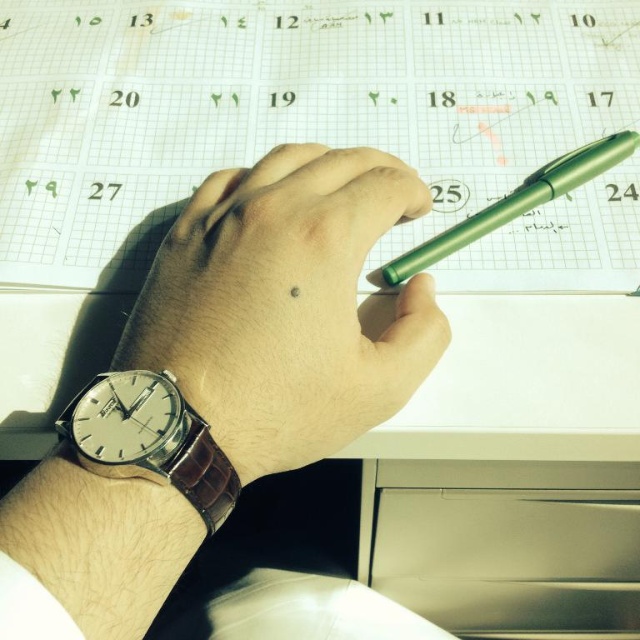
You are a person who needs to place a 30 cm long ruler on the desk. You see the sleek leather watch at center and the metallic silver drawer at lower right. Can you fit the ruler between them without bending it?

The distance between the sleek leather watch at center and the metallic silver drawer at lower right is 29.15 centimeters, so the ruler cannot fit straight between them as it is longer than the available space.

You are organizing your desk and need to place a 30 cm wide folder between the metallic silver drawer at lower right and the silver leather watch at lower left. Can you fit it without moving either object?

The distance between the metallic silver drawer at lower right and the silver leather watch at lower left is 40.81 centimeters. Since the folder is 30 cm wide, it can fit in the space between them as 30 cm is less than 40.81 cm.

You are organizing a desk and need to place both the metallic silver drawer at lower right and the silver leather watch at lower left. Considering their heights, which one should you place on a shelf that requires a taller item to stabilize the setup?

The metallic silver drawer at lower right is much taller than the silver leather watch at lower left, so you should place the metallic silver drawer at lower right on the shelf to stabilize the setup.